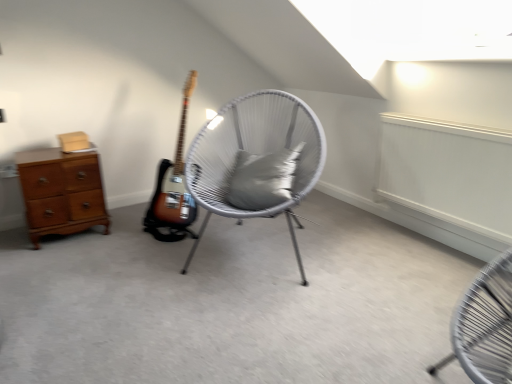
Question: Does gray fabric pillow at center have a greater height compared to white woven chair at center?

Choices:
 (A) no
 (B) yes

Answer: (A)

Question: Could you tell me if gray fabric pillow at center is turned towards white woven chair at center?

Choices:
 (A) no
 (B) yes

Answer: (B)

Question: Can you confirm if gray fabric pillow at center is shorter than white woven chair at center?

Choices:
 (A) yes
 (B) no

Answer: (A)

Question: Can we say gray fabric pillow at center lies outside white woven chair at center?

Choices:
 (A) no
 (B) yes

Answer: (A)

Question: Is gray fabric pillow at center further to the viewer compared to white woven chair at center?

Choices:
 (A) yes
 (B) no

Answer: (A)

Question: In terms of size, does white woven chair at center appear bigger or smaller than gray fabric pillow at center?

Choices:
 (A) small
 (B) big

Answer: (B)

Question: Considering the positions of point (283, 122) and point (266, 178), is point (283, 122) closer or farther from the camera than point (266, 178)?

Choices:
 (A) farther
 (B) closer

Answer: (A)

Question: From the image's perspective, is white woven chair at center positioned above or below gray fabric pillow at center?

Choices:
 (A) below
 (B) above

Answer: (A)

Question: Visually, is white woven chair at center positioned to the left or to the right of gray fabric pillow at center?

Choices:
 (A) left
 (B) right

Answer: (A)

Question: Considering the positions of gray fabric pillow at center and wooden chest of drawers at left in the image, is gray fabric pillow at center taller or shorter than wooden chest of drawers at left?

Choices:
 (A) short
 (B) tall

Answer: (A)

Question: Is gray fabric pillow at center situated inside wooden chest of drawers at left or outside?

Choices:
 (A) outside
 (B) inside

Answer: (A)

Question: Is point (257, 160) closer or farther from the camera than point (46, 221)?

Choices:
 (A) farther
 (B) closer

Answer: (B)

Question: Would you say gray fabric pillow at center is to the left or to the right of wooden chest of drawers at left in the picture?

Choices:
 (A) right
 (B) left

Answer: (A)

Question: Based on their positions, is wooden chest of drawers at left located to the left or right of gray fabric pillow at center?

Choices:
 (A) right
 (B) left

Answer: (B)

Question: Is wooden chest of drawers at left bigger or smaller than gray fabric pillow at center?

Choices:
 (A) big
 (B) small

Answer: (A)